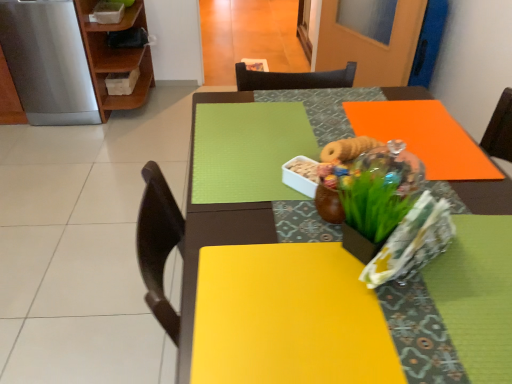
Question: From a real-world perspective, is wooden shelf at upper left on green matte floral arrangement at center?

Choices:
 (A) no
 (B) yes

Answer: (A)

Question: Is wooden shelf at upper left behind green matte floral arrangement at center?

Choices:
 (A) no
 (B) yes

Answer: (B)

Question: Does wooden shelf at upper left have a larger size compared to green matte floral arrangement at center?

Choices:
 (A) no
 (B) yes

Answer: (B)

Question: Can you confirm if wooden shelf at upper left is smaller than green matte floral arrangement at center?

Choices:
 (A) yes
 (B) no

Answer: (B)

Question: From the image's perspective, is wooden shelf at upper left above green matte floral arrangement at center?

Choices:
 (A) no
 (B) yes

Answer: (B)

Question: From a real-world perspective, relative to stainless steel refrigerator at left, is wooden shelf at upper left vertically above or below?

Choices:
 (A) above
 (B) below

Answer: (B)

Question: Is point (138, 3) positioned closer to the camera than point (57, 125)?

Choices:
 (A) closer
 (B) farther

Answer: (A)

Question: From the image's perspective, relative to stainless steel refrigerator at left, is wooden shelf at upper left above or below?

Choices:
 (A) above
 (B) below

Answer: (A)

Question: Would you say wooden shelf at upper left is to the left or to the right of stainless steel refrigerator at left in the picture?

Choices:
 (A) left
 (B) right

Answer: (B)

Question: From the image's perspective, is wooden shelf at upper left positioned above or below orange matte table at upper right?

Choices:
 (A) above
 (B) below

Answer: (A)

Question: In the image, is wooden shelf at upper left on the left side or the right side of orange matte table at upper right?

Choices:
 (A) right
 (B) left

Answer: (B)

Question: In the image, is wooden shelf at upper left positioned in front of or behind orange matte table at upper right?

Choices:
 (A) behind
 (B) front

Answer: (A)

Question: Is point [x=96, y=26] positioned closer to the camera than point [x=192, y=142]?

Choices:
 (A) farther
 (B) closer

Answer: (A)

Question: From a real-world perspective, is green matte floral arrangement at center above or below stainless steel refrigerator at left?

Choices:
 (A) below
 (B) above

Answer: (B)

Question: In terms of size, does green matte floral arrangement at center appear bigger or smaller than stainless steel refrigerator at left?

Choices:
 (A) small
 (B) big

Answer: (A)